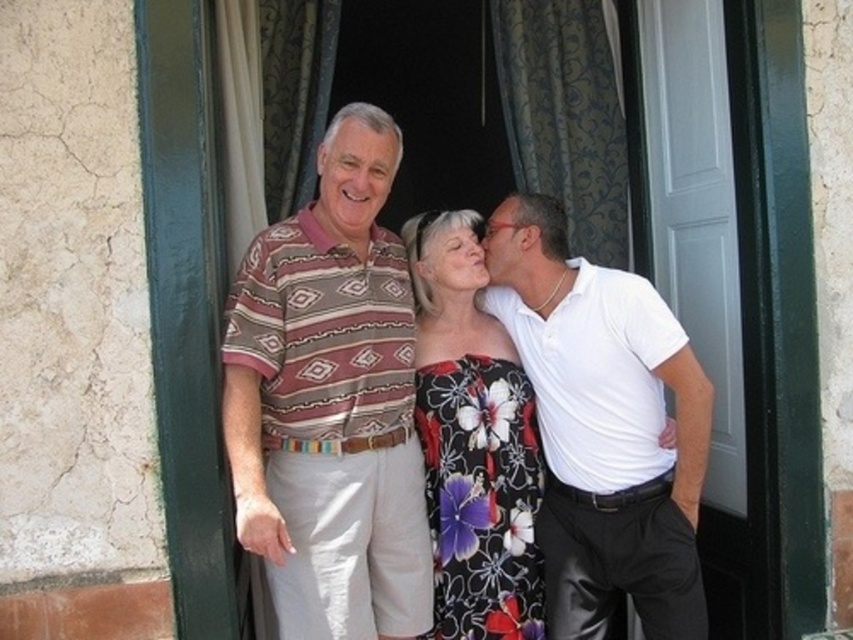
Question: Can you confirm if striped cotton shirt at center is thinner than matte brown shirt at center?

Choices:
 (A) yes
 (B) no

Answer: (B)

Question: Is the position of striped cotton shirt at center more distant than that of matte white face at center?

Choices:
 (A) no
 (B) yes

Answer: (A)

Question: Which point is closer to the camera?

Choices:
 (A) blue patterned curtain at upper center
 (B) white glossy shirt at right
 (C) matte brown shirt at center
 (D) floral dress at center

Answer: (C)

Question: Does matte brown shirt at center appear on the left side of matte white face at center?

Choices:
 (A) no
 (B) yes

Answer: (B)

Question: Which object is farther from the camera taking this photo?

Choices:
 (A) white glossy shirt at right
 (B) floral dress at center
 (C) matte white face at center
 (D) blue patterned curtain at upper center

Answer: (D)

Question: Which object appears farthest from the camera in this image?

Choices:
 (A) blue patterned curtain at upper center
 (B) floral dress at center
 (C) matte brown shirt at upper center

Answer: (A)